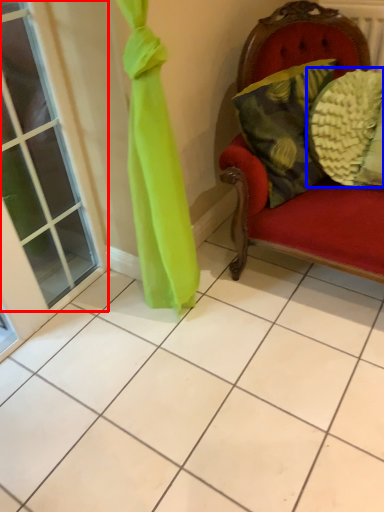
Question: Among these objects, which one is farthest to the camera, window (highlighted by a red box) or pillow (highlighted by a blue box)?

Choices:
 (A) window
 (B) pillow

Answer: (B)